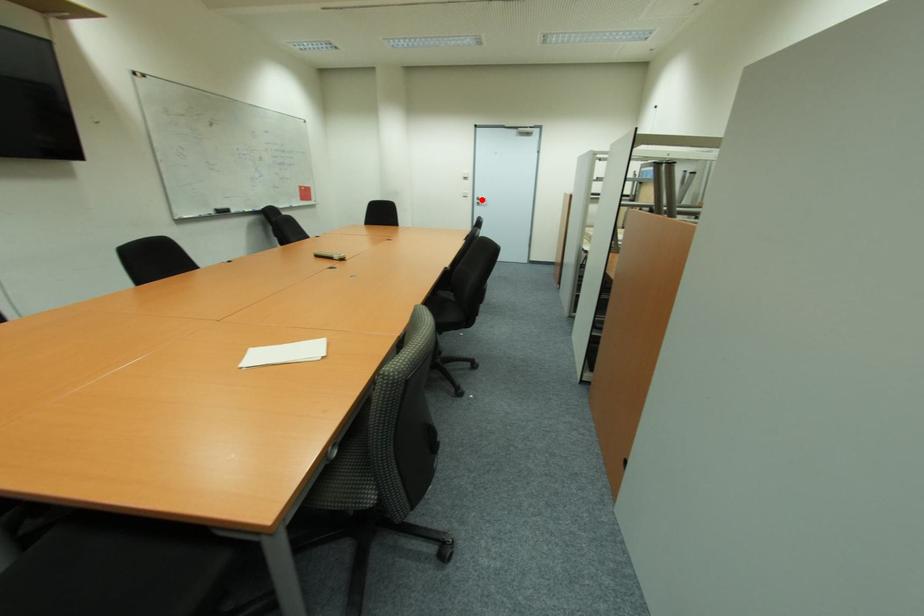
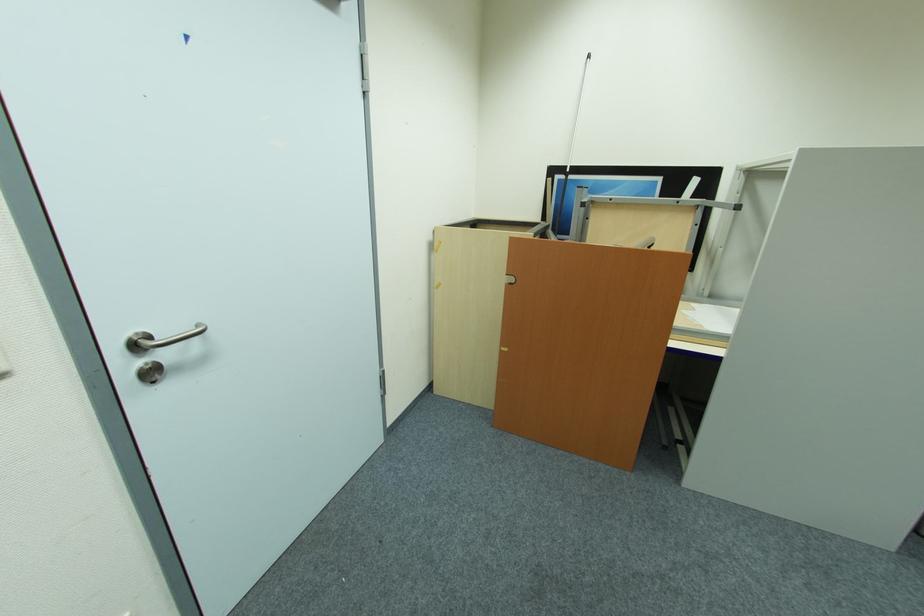
Where in the second image is the point corresponding to the highlighted location from the first image?

(141, 347)